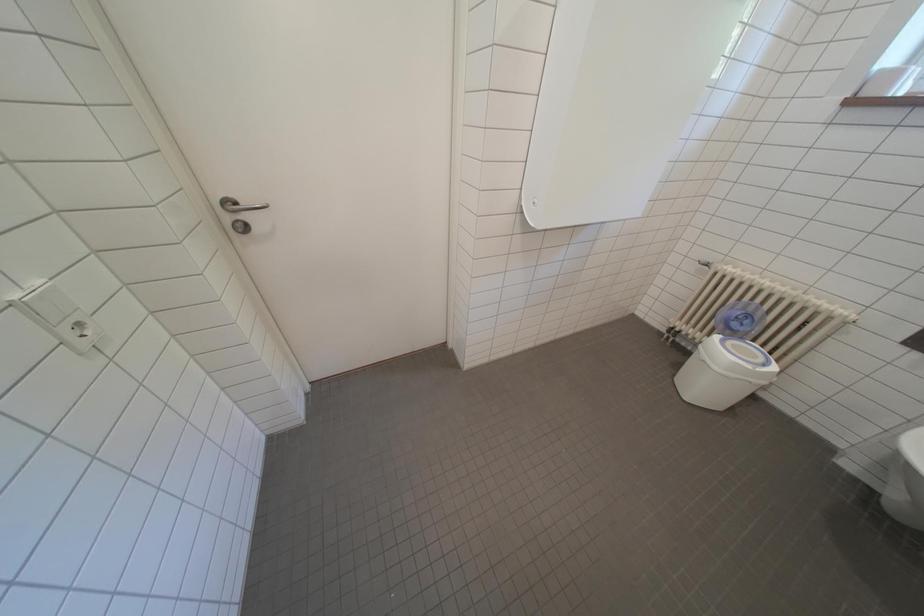
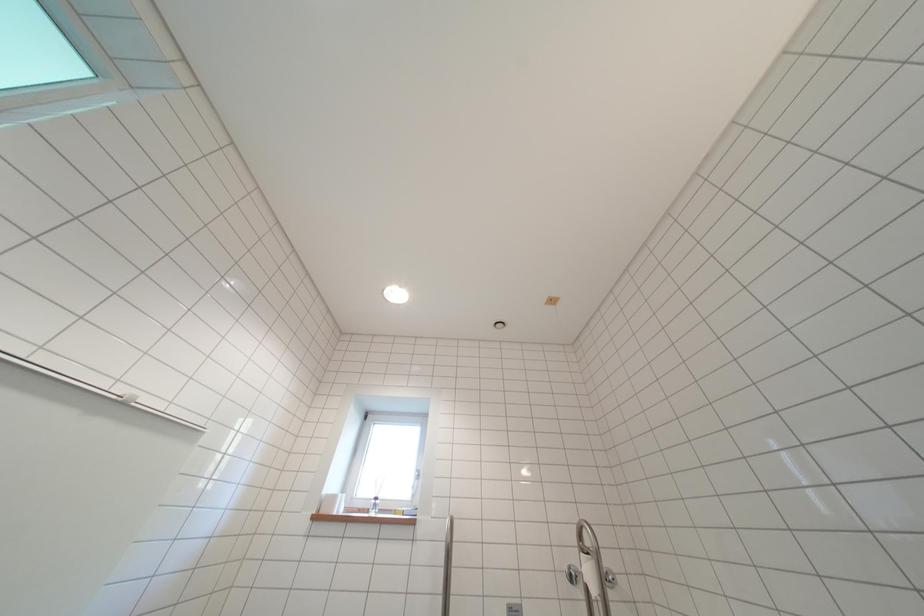
The images are taken continuously from a first-person perspective. In which direction is your viewpoint rotating?

The camera rotated toward right-up.